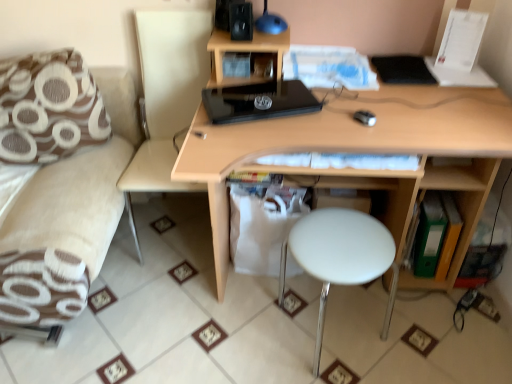
The width and height of the screenshot is (512, 384). I want to click on empty space that is ontop of white glossy stool at center (from a real-world perspective), so click(x=346, y=243).